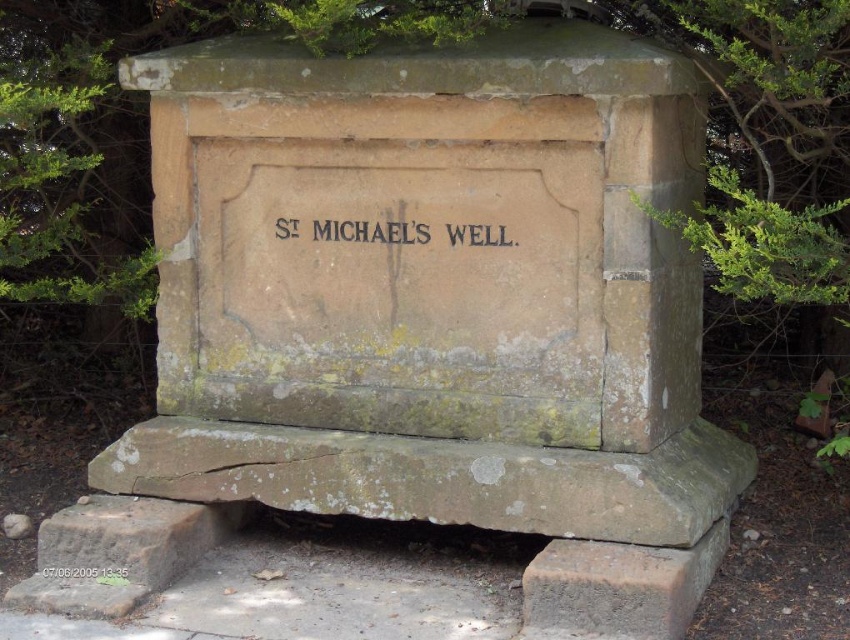
Question: Is brown stone monument at center smaller than dark brown stone plaque at center?

Choices:
 (A) no
 (B) yes

Answer: (A)

Question: Which point is farther to the camera?

Choices:
 (A) brown stone monument at center
 (B) dark brown stone plaque at center

Answer: (B)

Question: Which object is closer to the camera taking this photo?

Choices:
 (A) brown stone monument at center
 (B) dark brown stone plaque at center
 (C) black stone engraving at center

Answer: (A)

Question: From the image, what is the correct spatial relationship of brown stone monument at center in relation to dark brown stone plaque at center?

Choices:
 (A) left
 (B) right

Answer: (B)

Question: Does brown stone monument at center appear over dark brown stone plaque at center?

Choices:
 (A) no
 (B) yes

Answer: (B)

Question: Which object is the farthest from the brown stone monument at center?

Choices:
 (A) black stone engraving at center
 (B) dark brown stone plaque at center

Answer: (B)